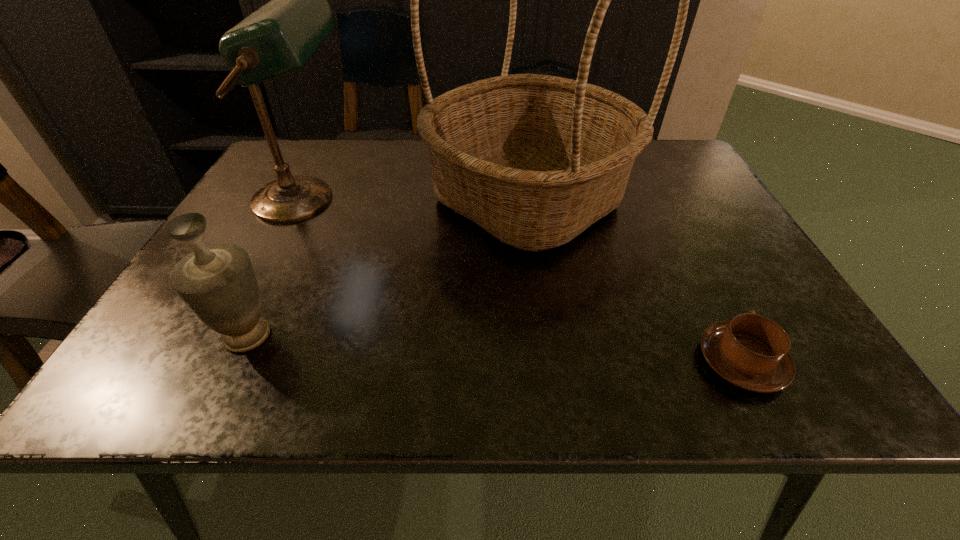
This screenshot has height=540, width=960. I want to click on object that is positioned at the near left corner, so click(217, 283).

Locate an element on the screen. The width and height of the screenshot is (960, 540). object that is positioned at the near right corner is located at coordinates [x=751, y=352].

You are a GUI agent. You are given a task and a screenshot of the screen. Output one action in this format:
    pyautogui.click(x=<x>, y=<y>)
    Task: Click on the vacant space at the far edge of the desktop
    This screenshot has height=540, width=960.
    Given the screenshot: What is the action you would take?
    pyautogui.click(x=361, y=147)

In the image, there is a desktop. In order to click on free region at the near edge in this screenshot , I will do pyautogui.click(x=585, y=400).

Where is `free spot at the right edge of the desktop`? free spot at the right edge of the desktop is located at coordinates (710, 322).

You are a GUI agent. You are given a task and a screenshot of the screen. Output one action in this format:
    pyautogui.click(x=<x>, y=<y>)
    Task: Click on the free space at the far left corner of the desktop
    Image resolution: width=960 pixels, height=540 pixels.
    Given the screenshot: What is the action you would take?
    pyautogui.click(x=267, y=180)

In the image, there is a desktop. Where is `vacant space at the near left corner`? Image resolution: width=960 pixels, height=540 pixels. vacant space at the near left corner is located at coordinates (190, 360).

Find the location of a particular element. The image size is (960, 540). vacant space that is in between the second tallest object and the tallest object is located at coordinates point(416,199).

Locate an element on the screen. The width and height of the screenshot is (960, 540). vacant region between the shortest object and the third shortest object is located at coordinates [523, 281].

At what (x,y) coordinates should I click in order to perform the action: click on free spot between the urn and the second object from right to left. Please return your answer as a coordinate pair (x, y). This screenshot has height=540, width=960. Looking at the image, I should click on (387, 267).